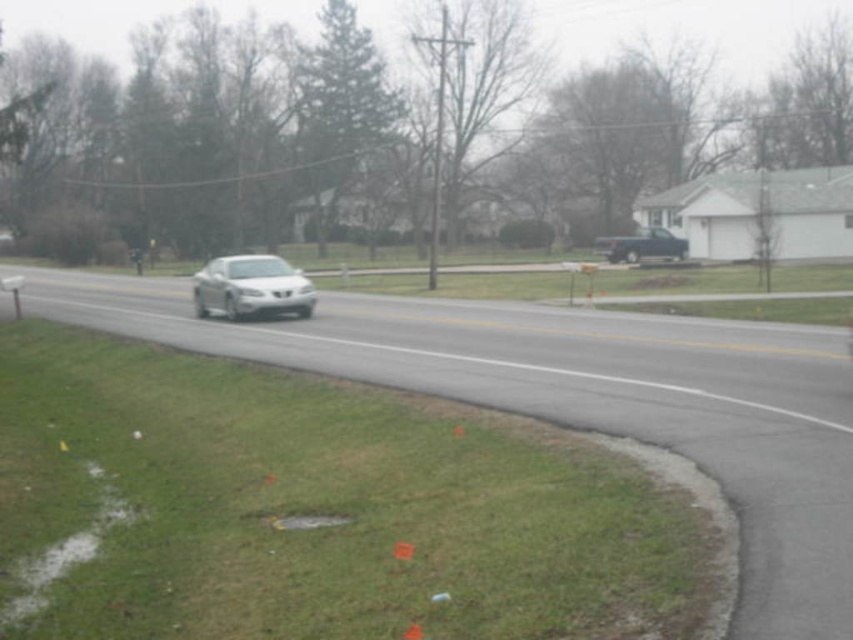
This screenshot has height=640, width=853. What are the coordinates of `satin silver sedan at center` in the screenshot? It's located at (251, 288).

Which is in front, point (314, 298) or point (595, 240)?

Point (314, 298) is more forward.

Is point (202, 269) positioned behind point (628, 252)?

No, (202, 269) is closer to viewer.

I want to click on satin silver sedan at center, so click(251, 288).